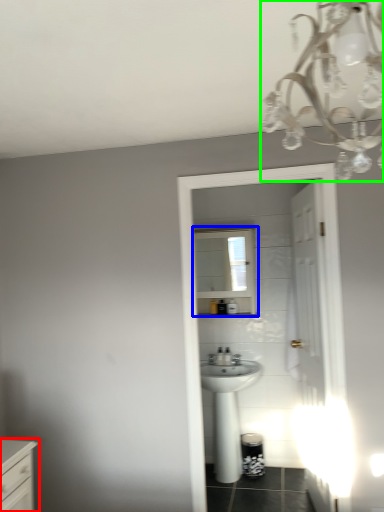
Question: Based on their relative distances, which object is farther from chest of drawers (highlighted by a red box)? Choose from medicine cabinet (highlighted by a blue box) and light fixture (highlighted by a green box).

Choices:
 (A) medicine cabinet
 (B) light fixture

Answer: (A)